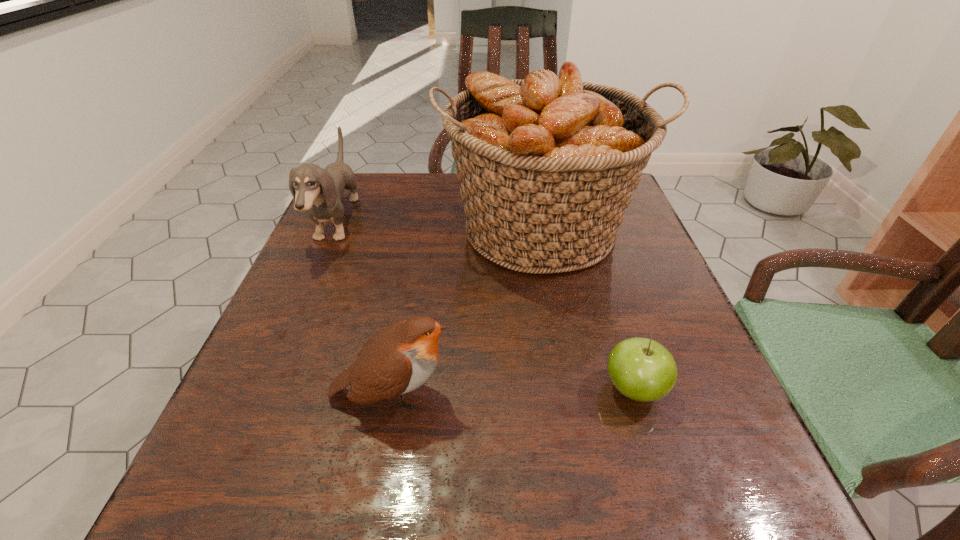
At what (x,y) coordinates should I click in order to perform the action: click on puppy that is at the left edge. Please return your answer as a coordinate pair (x, y). This screenshot has width=960, height=540. Looking at the image, I should click on (319, 191).

Locate an element on the screen. This screenshot has height=540, width=960. bird located in the left edge section of the desktop is located at coordinates (399, 358).

Where is `basket positioned at the right edge`? The width and height of the screenshot is (960, 540). basket positioned at the right edge is located at coordinates (547, 165).

Locate an element on the screen. Image resolution: width=960 pixels, height=540 pixels. apple present at the right edge is located at coordinates (643, 370).

In order to click on object that is at the far left corner in this screenshot , I will do `click(319, 191)`.

Locate an element on the screen. The height and width of the screenshot is (540, 960). object at the far right corner is located at coordinates pos(547,165).

The height and width of the screenshot is (540, 960). I want to click on vacant space at the far edge of the desktop, so click(x=462, y=200).

The height and width of the screenshot is (540, 960). In the image, there is a desktop. Find the location of `vacant region at the near edge`. vacant region at the near edge is located at coordinates (656, 530).

This screenshot has height=540, width=960. What are the coordinates of `vacant space at the left edge` in the screenshot? It's located at (274, 387).

At what (x,y) coordinates should I click in order to perform the action: click on vacant space at the right edge of the desktop. Please return your answer as a coordinate pair (x, y). This screenshot has height=540, width=960. Looking at the image, I should click on (631, 404).